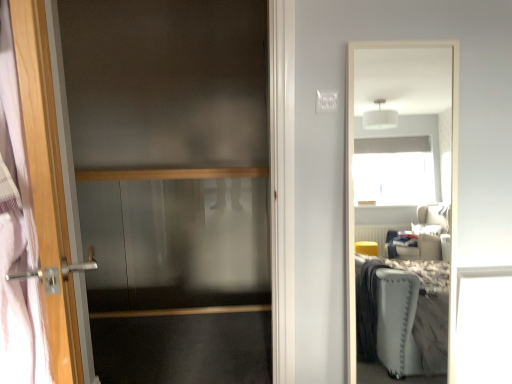
What do you see at coordinates (40, 129) in the screenshot? I see `wooden door handle at left` at bounding box center [40, 129].

I want to click on wooden door handle at left, so click(40, 129).

Locate an element on the screen. This screenshot has width=512, height=384. satin wood balustrade at center is located at coordinates (170, 174).

This screenshot has height=384, width=512. What do you see at coordinates (165, 82) in the screenshot?
I see `transparent glass screen door at left` at bounding box center [165, 82].

I want to click on wooden door handle at left, so click(x=40, y=129).

The width and height of the screenshot is (512, 384). Find the location of `door above the satin wood balustrade at center (from a real-world perspective)`. door above the satin wood balustrade at center (from a real-world perspective) is located at coordinates (40, 129).

Is wooden door handle at left wider than satin wood balustrade at center?

In fact, wooden door handle at left might be narrower than satin wood balustrade at center.

Based on the photo, from the image's perspective, between wooden door handle at left and satin wood balustrade at center, who is located below?

wooden door handle at left appears lower in the image.

Between satin wood balustrade at center and transparent glass screen door at left, which one has more height?

Standing taller between the two is transparent glass screen door at left.

From the picture: From a real-world perspective, which is physically above, satin wood balustrade at center or transparent glass screen door at left?

From a 3D spatial view, satin wood balustrade at center is above.

Would you say transparent glass screen door at left is part of satin wood balustrade at center's contents?

No, transparent glass screen door at left is not inside satin wood balustrade at center.

Is satin wood balustrade at center far from transparent glass screen door at left?

Yes, satin wood balustrade at center and transparent glass screen door at left are quite far apart.

Which of these two, wooden door handle at left or transparent glass screen door at left, stands shorter?

Standing shorter between the two is wooden door handle at left.

Which point is more forward, (x=54, y=208) or (x=238, y=91)?

The point (x=54, y=208) is more forward.

Between wooden door handle at left and transparent glass screen door at left, which one appears on the left side from the viewer's perspective?

wooden door handle at left.

The image size is (512, 384). Identify the location of screen door lying behind the wooden door handle at left. (165, 82).

Consider the image. Between satin wood balustrade at center and wooden door handle at left, which one has more height?

wooden door handle at left.

What's the angular difference between satin wood balustrade at center and wooden door handle at left's facing directions?

satin wood balustrade at center and wooden door handle at left are facing 111 degrees away from each other.

Which of these two, satin wood balustrade at center or wooden door handle at left, is wider?

satin wood balustrade at center is wider.

Is satin wood balustrade at center positioned with its back to wooden door handle at left?

No, satin wood balustrade at center is not facing away from wooden door handle at left.

From a real-world perspective, is transparent glass screen door at left physically located above or below satin wood balustrade at center?

From a real-world perspective, transparent glass screen door at left is physically below satin wood balustrade at center.

Can you confirm if transparent glass screen door at left is smaller than satin wood balustrade at center?

No.

Considering the sizes of transparent glass screen door at left and wooden door handle at left in the image, is transparent glass screen door at left wider or thinner than wooden door handle at left?

Clearly, transparent glass screen door at left has less width compared to wooden door handle at left.

Which is in front, point (132, 125) or point (49, 325)?

The point (49, 325) is more forward.

Considering the relative sizes of transparent glass screen door at left and wooden door handle at left in the image provided, is transparent glass screen door at left taller than wooden door handle at left?

Yes.

Does transparent glass screen door at left turn towards wooden door handle at left?

Yes, transparent glass screen door at left is facing wooden door handle at left.

Where is `balustrade behind the wooden door handle at left`? The width and height of the screenshot is (512, 384). balustrade behind the wooden door handle at left is located at coordinates (170, 174).

This screenshot has height=384, width=512. I want to click on balustrade that appears on the left of transparent glass screen door at left, so click(170, 174).

Considering their positions, is satin wood balustrade at center positioned further to transparent glass screen door at left than wooden door handle at left?

The object further to transparent glass screen door at left is wooden door handle at left.

Based on their spatial positions, is transparent glass screen door at left or satin wood balustrade at center closer to wooden door handle at left?

Among the two, satin wood balustrade at center is located nearer to wooden door handle at left.

When comparing their distances from transparent glass screen door at left, does wooden door handle at left or satin wood balustrade at center seem further?

Among the two, wooden door handle at left is located further to transparent glass screen door at left.

Which object lies nearer to the anchor point wooden door handle at left, satin wood balustrade at center or transparent glass screen door at left?

satin wood balustrade at center is positioned closer to the anchor wooden door handle at left.

Considering their positions, is transparent glass screen door at left positioned closer to satin wood balustrade at center than wooden door handle at left?

transparent glass screen door at left.

Estimate the real-world distances between objects in this image. Which object is further from satin wood balustrade at center, wooden door handle at left or transparent glass screen door at left?

wooden door handle at left lies further to satin wood balustrade at center than the other object.

Find the location of `screen door located between wooden door handle at left and satin wood balustrade at center in the depth direction`. screen door located between wooden door handle at left and satin wood balustrade at center in the depth direction is located at coordinates (165, 82).